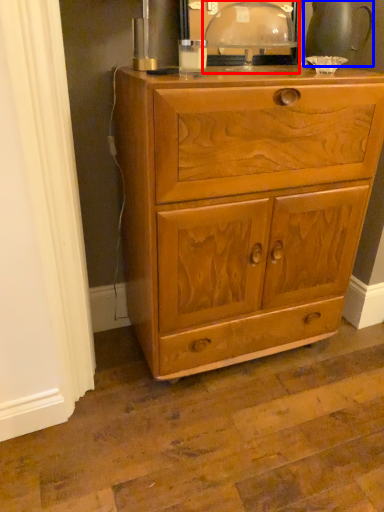
Question: Which of the following is the farthest to the observer, table lamp (highlighted by a red box) or tea pot (highlighted by a blue box)?

Choices:
 (A) table lamp
 (B) tea pot

Answer: (B)